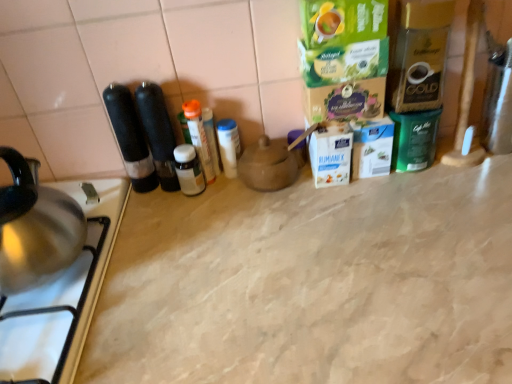
Find the location of a particular element. This screenshot has width=512, height=384. vacant region in front of translucent plastic bottle at center, placed as the second bottle when sorted from left to right is located at coordinates (205, 234).